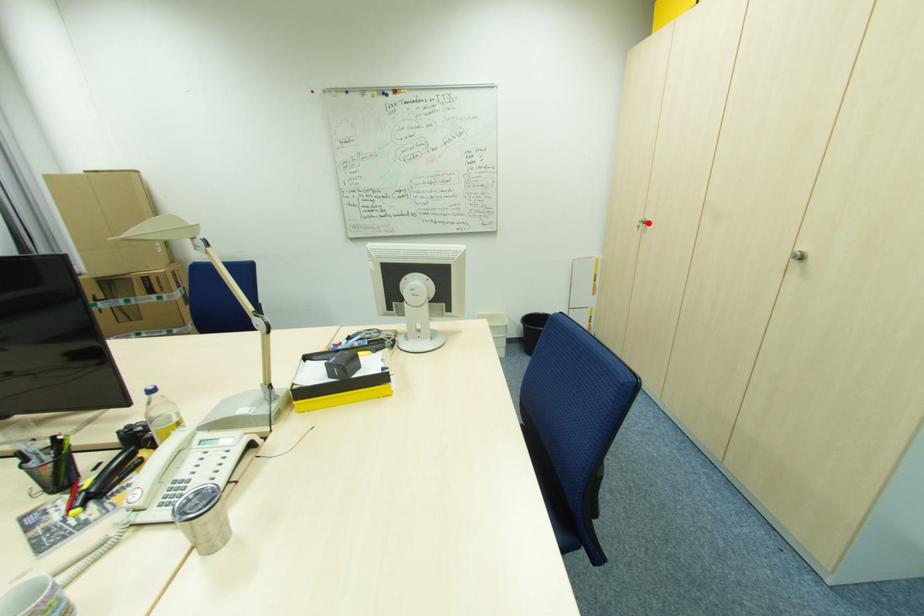
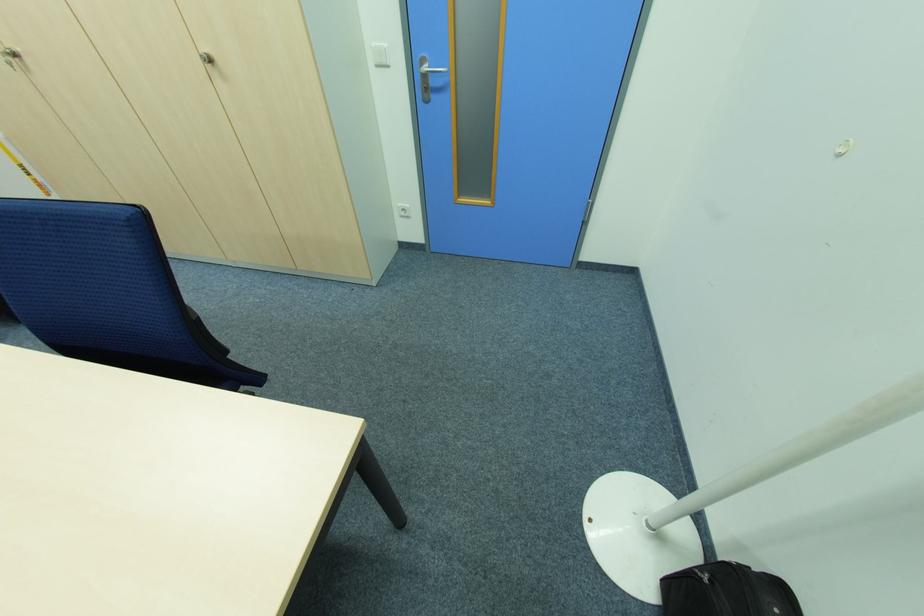
The point at the highlighted location is marked in the first image. Where is the corresponding point in the second image?

(18, 55)